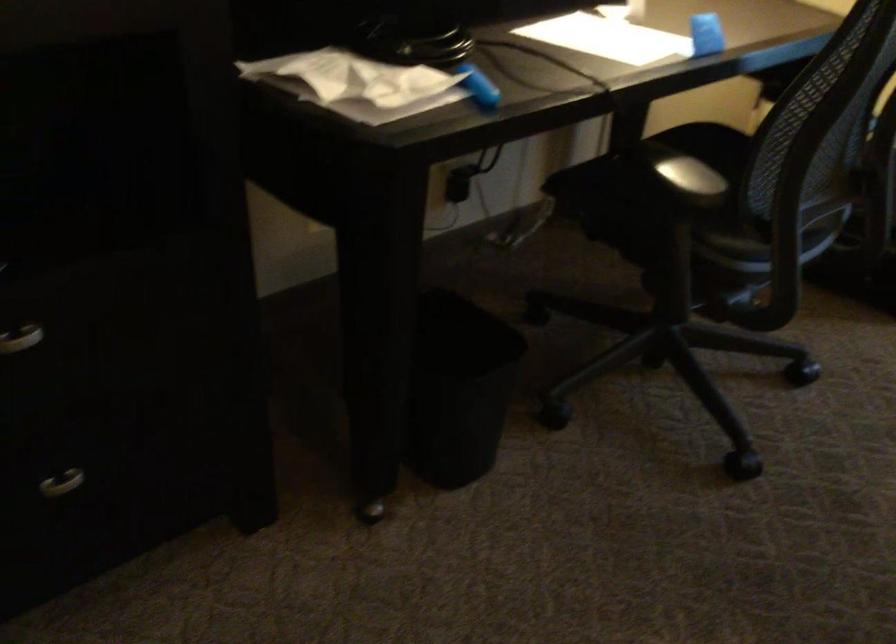
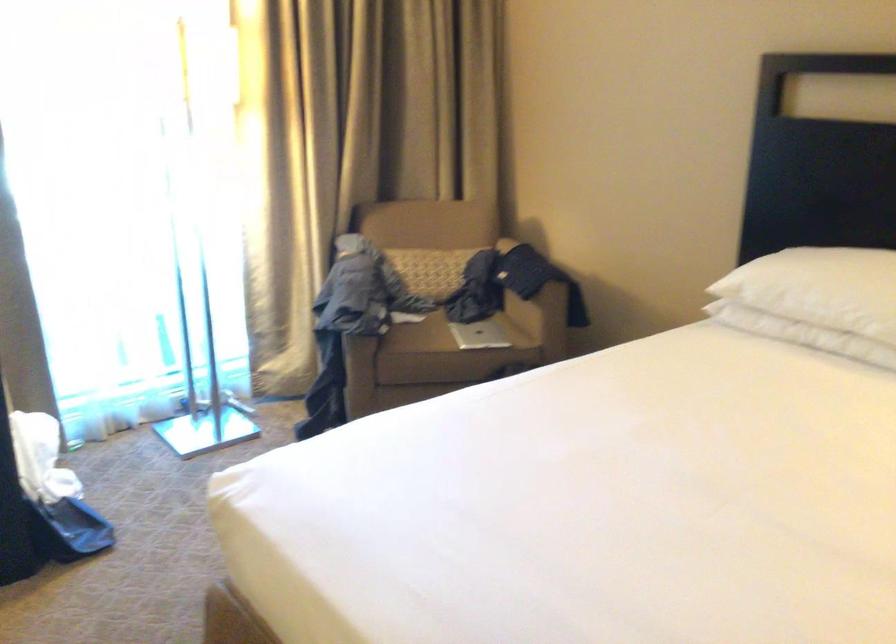
Question: The camera is either moving clockwise (left) or counter-clockwise (right) around the object. The first image is from the beginning of the video and the second image is from the end. Is the camera moving left or right when shooting the video?

Choices:
 (A) Left
 (B) Right

Answer: (A)